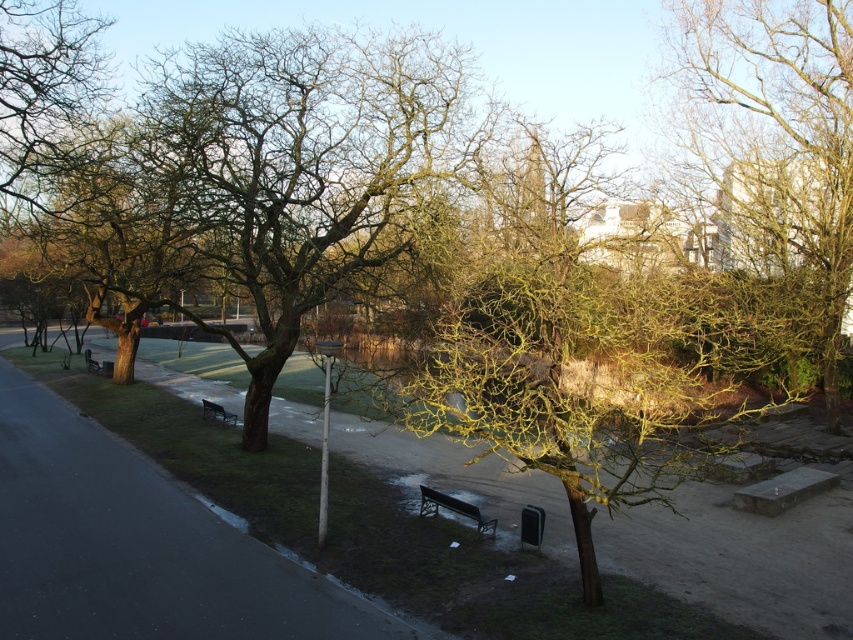
Question: Which object appears closest to the camera in this image?

Choices:
 (A) green mossy tree at upper right
 (B) metallic silver bench at center
 (C) green mossy tree at center
 (D) wooden park bench at left

Answer: (C)

Question: Which of these objects is positioned closest to the green mossy tree at upper right?

Choices:
 (A) wooden park bench at left
 (B) green mossy tree at center

Answer: (B)

Question: Which object is the farthest from the metallic silver bench at center?

Choices:
 (A) wooden park bench at left
 (B) green mossy tree at center

Answer: (A)

Question: Is metallic silver bench at center smaller than wooden park bench at left?

Choices:
 (A) yes
 (B) no

Answer: (A)

Question: Does metallic silver bench at center appear on the right side of wooden park bench at left?

Choices:
 (A) no
 (B) yes

Answer: (B)

Question: In this image, where is green mossy tree at upper right located relative to metallic silver bench at center?

Choices:
 (A) above
 (B) below

Answer: (A)